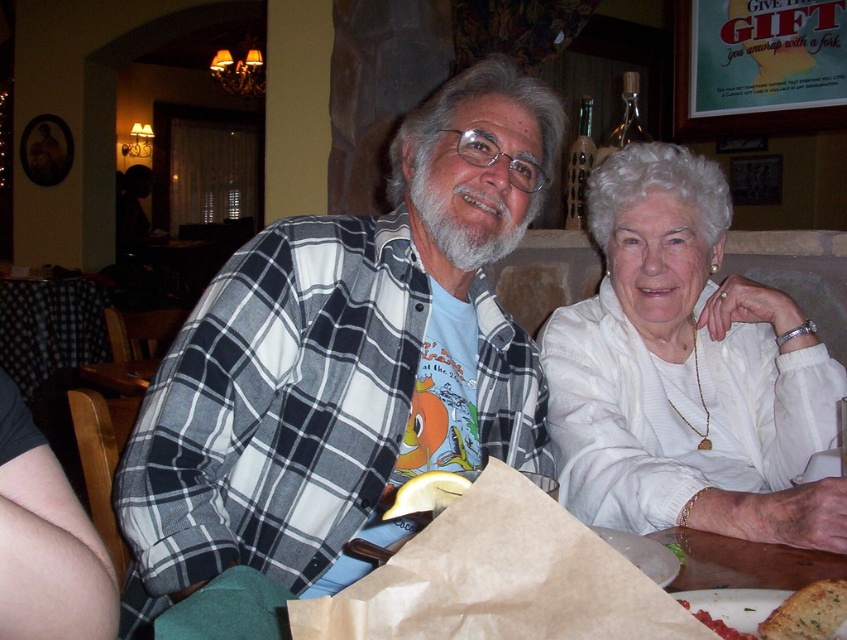
Between brown paper bag at lower center and yellow rubbery lemon at center, which one appears on the left side from the viewer's perspective?

yellow rubbery lemon at center

Between point (335, 628) and point (436, 470), which one is positioned in front?

Point (335, 628) is more forward.

Find the location of a particular element. The image size is (847, 640). brown paper bag at lower center is located at coordinates (499, 579).

Based on the photo, who is more forward, [261,435] or [523,483]?

Point [523,483] is more forward.

Is point (314, 312) positioned behind point (546, 552)?

Yes, it is behind point (546, 552).

Does point (297, 376) lie behind point (471, 524)?

Yes, it is.

I want to click on plaid flannel shirt at center, so click(346, 362).

Does brown paper bag at lower center have a greater height compared to white crumbly bread at lower right?

Yes.

Is brown paper bag at lower center positioned before white crumbly bread at lower right?

That is True.

Which is in front, point (308, 632) or point (726, 632)?

Point (308, 632)

Where is `brown paper bag at lower center`? The width and height of the screenshot is (847, 640). brown paper bag at lower center is located at coordinates (499, 579).